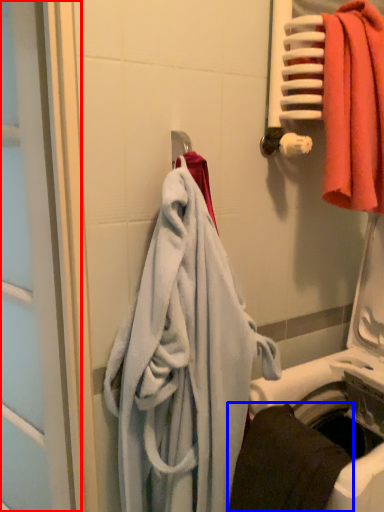
Question: Which point is closer to the camera, screen door (highlighted by a red box) or towel (highlighted by a blue box)?

Choices:
 (A) screen door
 (B) towel

Answer: (B)